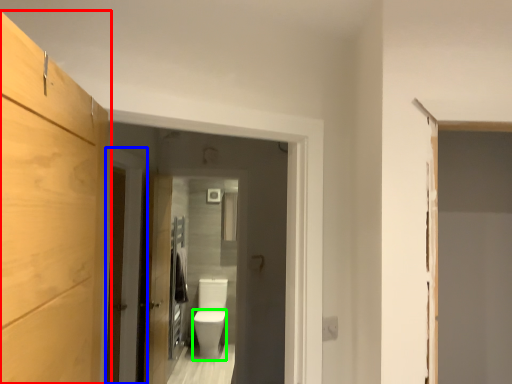
Question: Based on their relative distances, which object is nearer to cabinetry (highlighted by a red box)? Choose from door (highlighted by a blue box) and toilet bowl (highlighted by a green box).

Choices:
 (A) door
 (B) toilet bowl

Answer: (A)